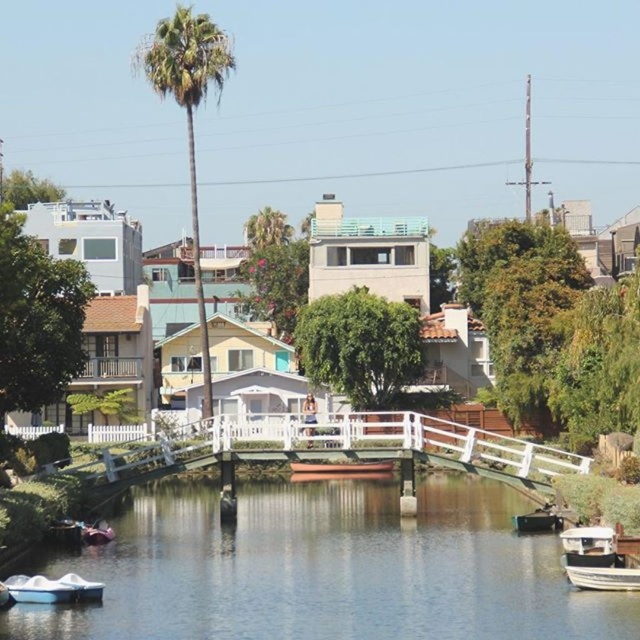
Does white matte boat at lower left have a lesser width compared to white matte boat at lower right?

No.

Is white matte boat at lower left behind white matte boat at lower right?

No, white matte boat at lower left is closer to the viewer.

Is point (32, 596) positioned in front of point (566, 570)?

Yes, it is in front of point (566, 570).

Find the location of a particular element. white matte boat at lower left is located at coordinates (38, 589).

Can you confirm if green leafy palm tree at upper left is bigger than white matte boat at lower left?

Correct, green leafy palm tree at upper left is larger in size than white matte boat at lower left.

Which is in front, point (205, 417) or point (36, 586)?

Positioned in front is point (36, 586).

Where is `green leafy palm tree at upper left`? The image size is (640, 640). green leafy palm tree at upper left is located at coordinates (188, 112).

Is white matte boat at lower left taller than metallic silver boat at lower center?

No, white matte boat at lower left is not taller than metallic silver boat at lower center.

Is white matte boat at lower left shorter than metallic silver boat at lower center?

Indeed, white matte boat at lower left has a lesser height compared to metallic silver boat at lower center.

Is point (28, 577) closer to viewer compared to point (548, 525)?

Yes, point (28, 577) is in front of point (548, 525).

You are a GUI agent. You are given a task and a screenshot of the screen. Output one action in this format:
    pyautogui.click(x=<x>, y=<y>)
    Task: Click on the white matte boat at lower left
    The height and width of the screenshot is (640, 640).
    Given the screenshot: What is the action you would take?
    pyautogui.click(x=38, y=589)